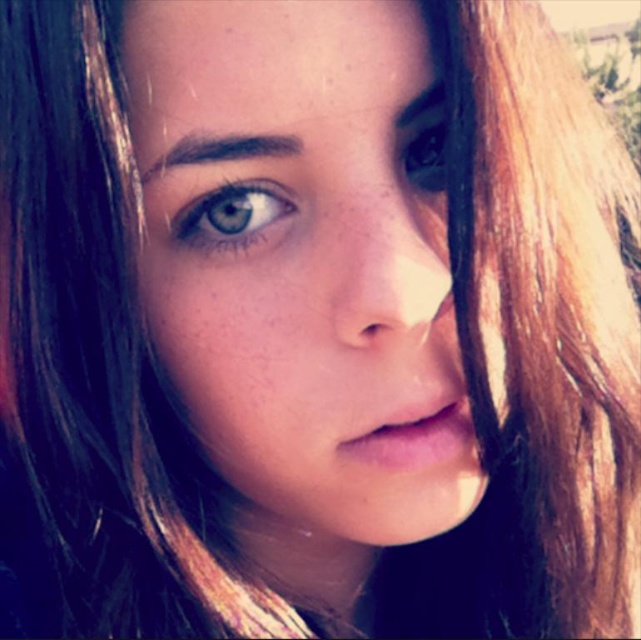
Between blue glossy eye at center and shiny brown eye at upper right, which one has more height?

With more height is shiny brown eye at upper right.

Does blue glossy eye at center have a smaller size compared to shiny brown eye at upper right?

Indeed, blue glossy eye at center has a smaller size compared to shiny brown eye at upper right.

Locate an element on the screen. blue glossy eye at center is located at coordinates (231, 214).

Who is shorter, smooth skin face at center or blue glossy eye at center?

blue glossy eye at center

Who is taller, smooth skin face at center or blue glossy eye at center?

smooth skin face at center

Is point (147, 104) behind point (229, 230)?

No, it is not.

I want to click on smooth skin face at center, so pyautogui.click(x=303, y=260).

Which of these two, smooth skin face at center or shiny brown eye at upper right, stands shorter?

shiny brown eye at upper right is shorter.

Is point (235, 412) positioned behind point (442, 173)?

No, it is in front of (442, 173).

At what (x,y) coordinates should I click in order to perform the action: click on smooth skin face at center. Please return your answer as a coordinate pair (x, y). The width and height of the screenshot is (641, 640). Looking at the image, I should click on (303, 260).